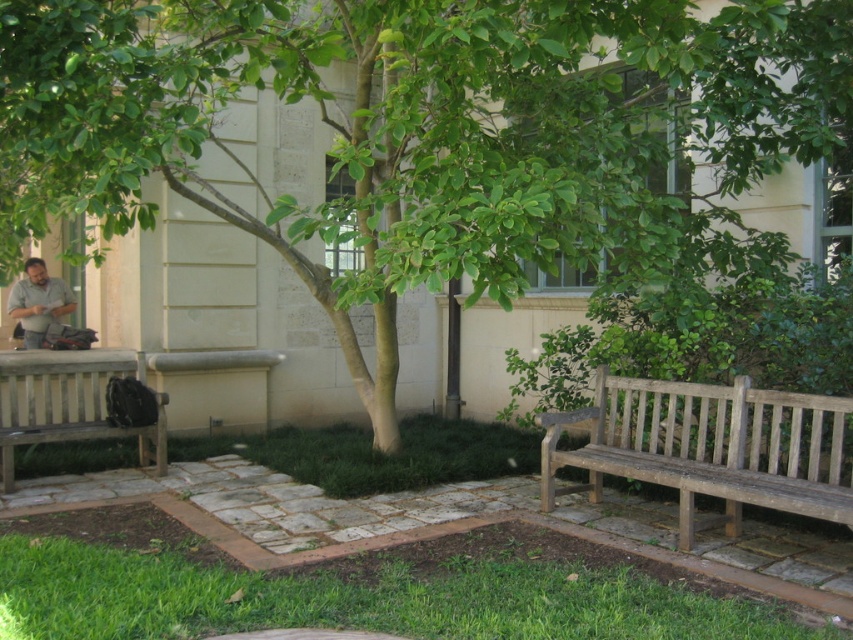
You are a gardener who needs to water the green leafy tree at center and the weathered wood bench at lower right. You have a hose that can reach 5 feet. Starting from the tree, can you water the bench without moving the hose nozzle?

The distance between the green leafy tree at center and the weathered wood bench at lower right is 5.03 feet. Since the hose can only reach 5 feet, it is just slightly too short to water the bench from the tree without moving the nozzle.

You are a photographer setting up a tripod in the scene. You need to place it between the weathered wood bench at lower right and the matte gray shirt at left. Which object should you position the tripod closer to if you want it to be near the larger object?

The weathered wood bench at lower right is larger in size than the matte gray shirt at left, so you should position the tripod closer to the weathered wood bench at lower right.

You are planning to place a new bench in the scene. The existing weathered wood bench at lower right and the matte gray shirt at left are in the way. Which object should you move to make space for the new bench?

The weathered wood bench at lower right should be moved because it is wider than the matte gray shirt at left, providing more space for the new bench.